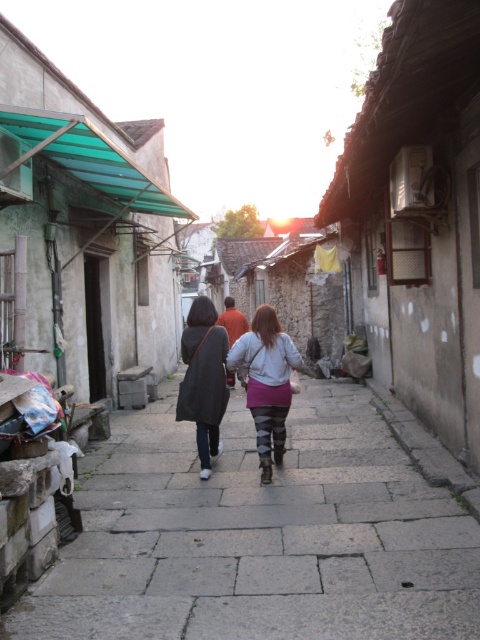
Which is more to the right, gray stone pavement at center or gray fabric jacket at center?

gray fabric jacket at center is more to the right.

Can you confirm if gray stone pavement at center is positioned below gray fabric jacket at center?

Yes, gray stone pavement at center is below gray fabric jacket at center.

Between point (280, 616) and point (273, 396), which one is positioned behind?

The point (273, 396) is behind.

Identify the location of gray stone pavement at center. Image resolution: width=480 pixels, height=640 pixels. (259, 536).

This screenshot has width=480, height=640. Find the location of `gray fabric jacket at center`. gray fabric jacket at center is located at coordinates (266, 381).

Measure the distance between point (284, 413) and camera.

Point (284, 413) is 6.60 meters away from camera.

The image size is (480, 640). I want to click on gray fabric jacket at center, so click(266, 381).

You are a GUI agent. You are given a task and a screenshot of the screen. Output one action in this format:
    pyautogui.click(x=<x>, y=<y>)
    Task: Click on the gray stone pavement at center
    
    Given the screenshot: What is the action you would take?
    pyautogui.click(x=259, y=536)

Who is positioned more to the right, gray stone pavement at center or dark gray coat at center?

From the viewer's perspective, gray stone pavement at center appears more on the right side.

The width and height of the screenshot is (480, 640). Find the location of `gray stone pavement at center`. gray stone pavement at center is located at coordinates (x=259, y=536).

The height and width of the screenshot is (640, 480). What are the coordinates of `gray stone pavement at center` in the screenshot? It's located at (259, 536).